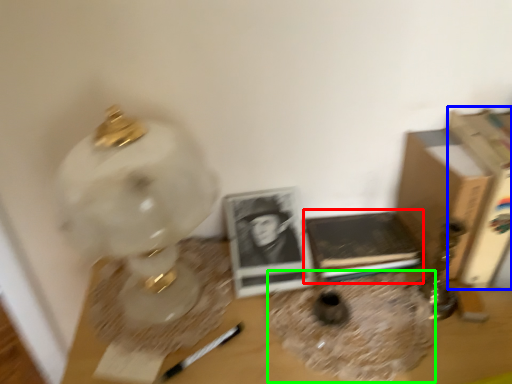
Question: Which is nearer to the paperback book (highlighted by a red box)? paperback book (highlighted by a blue box) or vase (highlighted by a green box).

Choices:
 (A) paperback book
 (B) vase

Answer: (B)